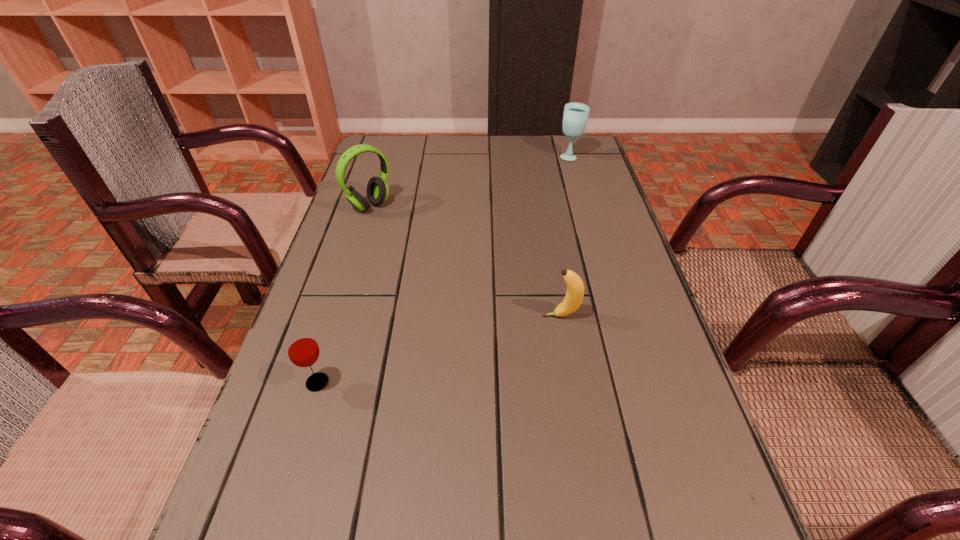
This screenshot has height=540, width=960. I want to click on vacant space at the right edge of the desktop, so click(x=573, y=204).

Locate an element on the screen. The height and width of the screenshot is (540, 960). free space at the far right corner of the desktop is located at coordinates (559, 146).

You are a GUI agent. You are given a task and a screenshot of the screen. Output one action in this format:
    pyautogui.click(x=<x>, y=<y>)
    Task: Click on the unoccupied area between the nearer glass and the farther glass
    The height and width of the screenshot is (540, 960).
    Given the screenshot: What is the action you would take?
    pyautogui.click(x=444, y=269)

Where is `vacant area that lies between the taller glass and the second object from right to left`? The image size is (960, 540). vacant area that lies between the taller glass and the second object from right to left is located at coordinates 565,236.

I want to click on free space that is in between the left glass and the right glass, so click(444, 269).

This screenshot has height=540, width=960. In order to click on empty location between the second object from right to left and the second farthest object in this screenshot , I will do `click(466, 261)`.

The image size is (960, 540). I want to click on object that is the third closest to the headset, so click(x=575, y=117).

Select which object appears as the third closest to the third object from left to right. Please provide its 2D coordinates. Your answer should be formatted as a tuple, i.e. [(x, y)], where the tuple contains the x and y coordinates of a point satisfying the conditions above.

[(575, 117)]

The height and width of the screenshot is (540, 960). Find the location of `the closest glass to the banana`. the closest glass to the banana is located at coordinates (302, 348).

You are a GUI agent. You are given a task and a screenshot of the screen. Output one action in this format:
    pyautogui.click(x=<x>, y=<y>)
    Task: Click on the free location that satisfies the following two spatial constraints: 1. on the front side of the shorter glass; 2. on the left side of the headset
    The height and width of the screenshot is (540, 960).
    Given the screenshot: What is the action you would take?
    pyautogui.click(x=315, y=382)